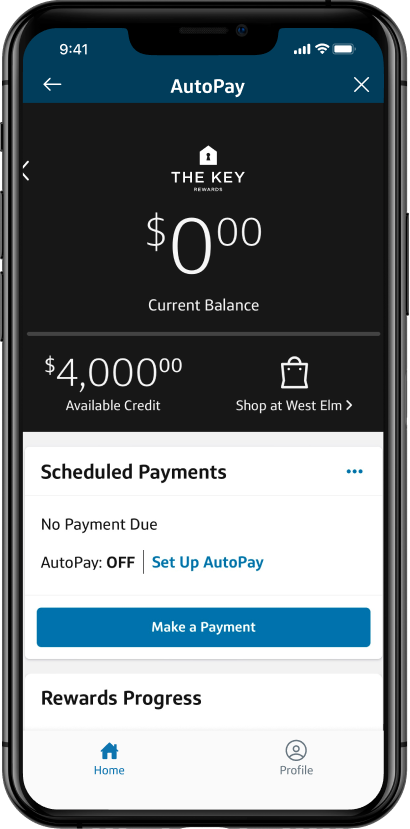
Locate an element on the screen. The image size is (410, 829). service bars is located at coordinates (304, 51).